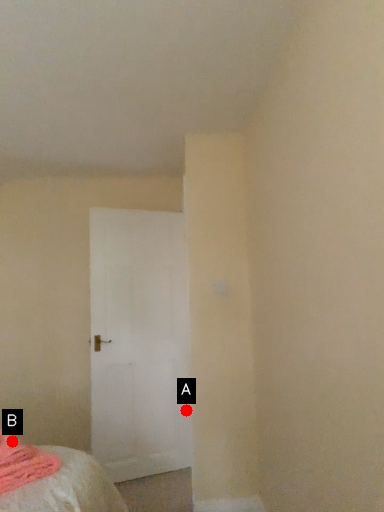
Question: Two points are circled on the image, labeled by A and B beside each circle. Which point is closer to the camera?

Choices:
 (A) A is closer
 (B) B is closer

Answer: (B)